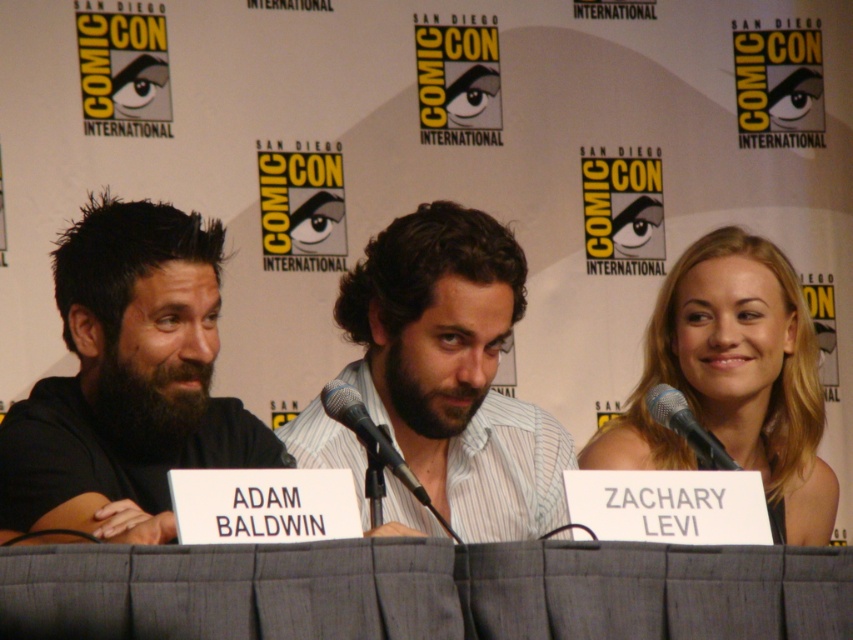
Is blonde hair at right shorter than silver metallic microphone at center?

No.

Between point (805, 524) and point (645, 401), which one is positioned behind?

Positioned behind is point (805, 524).

The height and width of the screenshot is (640, 853). What are the coordinates of `blonde hair at right` in the screenshot? It's located at (734, 380).

Which is in front, point (215, 307) or point (379, 433)?

Positioned in front is point (379, 433).

Who is more distant from viewer, (36, 397) or (421, 492)?

The point (36, 397) is behind.

Identify the location of dark brown hair at left. (126, 380).

Is light blue striped shirt at center behind blonde hair at right?

No.

What are the coordinates of `light blue striped shirt at center` in the screenshot? It's located at (453, 369).

Find the location of a particular element. The height and width of the screenshot is (640, 853). light blue striped shirt at center is located at coordinates (453, 369).